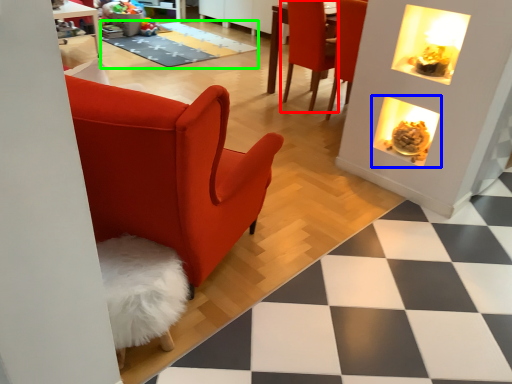
Question: Estimate the real-world distances between objects in this image. Which object is closer to chair (highlighted by a red box), fireplace (highlighted by a blue box) or mat (highlighted by a green box)?

Choices:
 (A) fireplace
 (B) mat

Answer: (A)